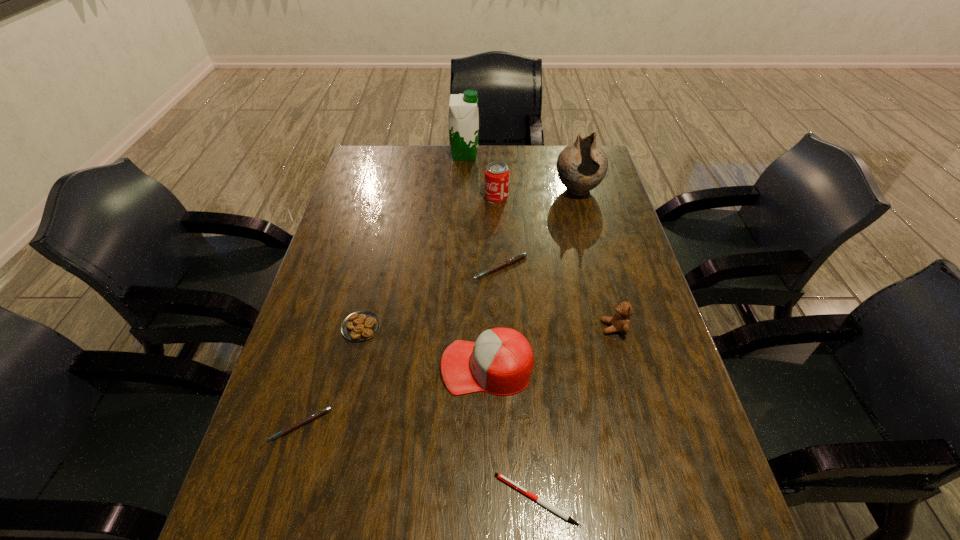
The image size is (960, 540). Find the location of `vacant position in the image that satisfies the following two spatial constraints: 1. on the front-facing side of the can; 2. on the left side of the soya milk`. vacant position in the image that satisfies the following two spatial constraints: 1. on the front-facing side of the can; 2. on the left side of the soya milk is located at coordinates (463, 197).

You are a GUI agent. You are given a task and a screenshot of the screen. Output one action in this format:
    pyautogui.click(x=<x>, y=<y>)
    Task: Click on the vacant space that satisfies the following two spatial constraints: 1. from the spout of the pottery; 2. on the front-facing side of the red baseball cap
    
    Given the screenshot: What is the action you would take?
    pyautogui.click(x=624, y=367)